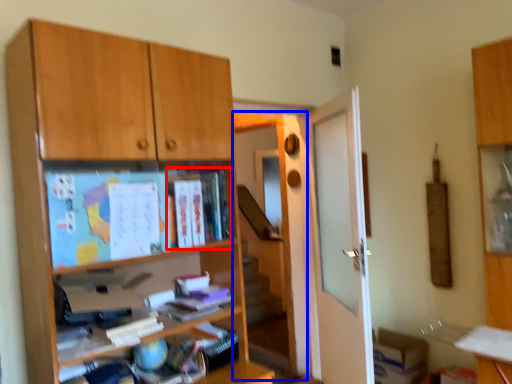
Question: Which of the following is the closest to the observer, book (highlighted by a red box) or screen door (highlighted by a blue box)?

Choices:
 (A) book
 (B) screen door

Answer: (A)